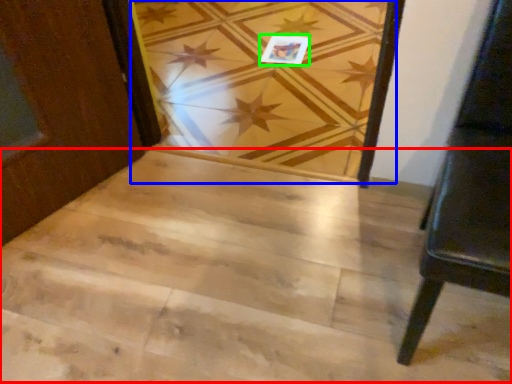
Question: Which is nearer to the stairwell (highlighted by a red box)? plank (highlighted by a blue box) or postcard (highlighted by a green box).

Choices:
 (A) plank
 (B) postcard

Answer: (A)